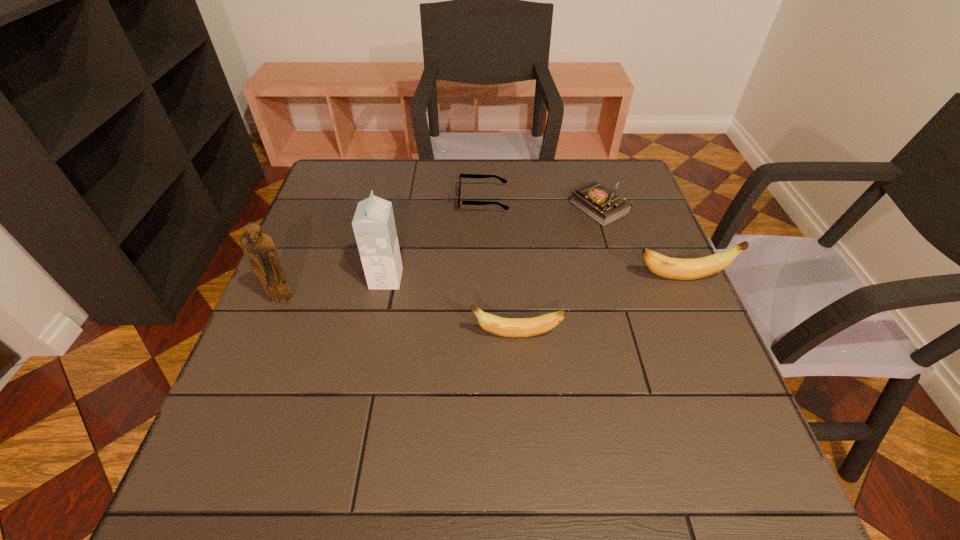
Please point a vacant point for placing a banana on the left. Please provide its 2D coordinates. Your answer should be formatted as a tuple, i.e. [(x, y)], where the tuple contains the x and y coordinates of a point satisfying the conditions above.

[(303, 408)]